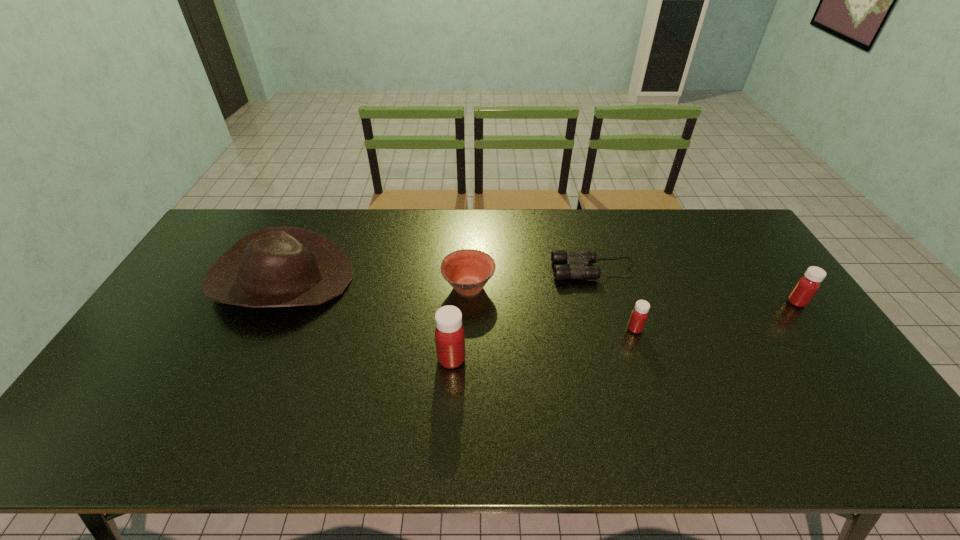
Locate an element on the screen. object that is at the far left corner is located at coordinates (277, 266).

The image size is (960, 540). In the image, there is a desktop. In order to click on vacant space at the far edge in this screenshot , I will do `click(536, 226)`.

Where is `free space at the near edge`? free space at the near edge is located at coordinates (422, 381).

Where is `vacant point at the left edge`? This screenshot has height=540, width=960. vacant point at the left edge is located at coordinates (174, 295).

In the image, there is a desktop. Identify the location of vacant space at the right edge. The width and height of the screenshot is (960, 540). pyautogui.click(x=821, y=355).

You are a GUI agent. You are given a task and a screenshot of the screen. Output one action in this format:
    pyautogui.click(x=<x>, y=<y>)
    Task: Click on the free space at the far left corner
    
    Given the screenshot: What is the action you would take?
    pyautogui.click(x=235, y=228)

Locate an element on the screen. This screenshot has width=960, height=540. free space at the far right corner of the desktop is located at coordinates (722, 225).

I want to click on vacant space that is in between the bowl and the shortest medicine, so click(552, 308).

In order to click on empty space that is in between the shortest medicine and the leftmost object in this screenshot , I will do `click(459, 304)`.

This screenshot has width=960, height=540. What are the coordinates of `vacant space that's between the rightmost medicine and the bowl` in the screenshot? It's located at (633, 294).